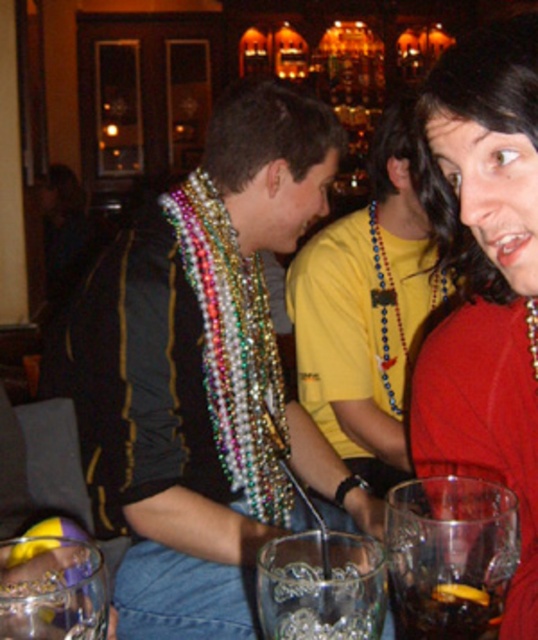
From the picture: You are at a party and see the multicolored beaded necklace at center and the dark brown liquid at center. Which object is located to the right of the other?

→ The multicolored beaded necklace at center is positioned on the right side of dark brown liquid at center.

You are standing at the entrance of the room and want to locate the multicolored beaded necklace at center. According to the coordinates given, in which general direction should you look to find it?

The multicolored beaded necklace at center is located at coordinates point (366,312), which would be in the center of the image. So you should look straight ahead to find it.